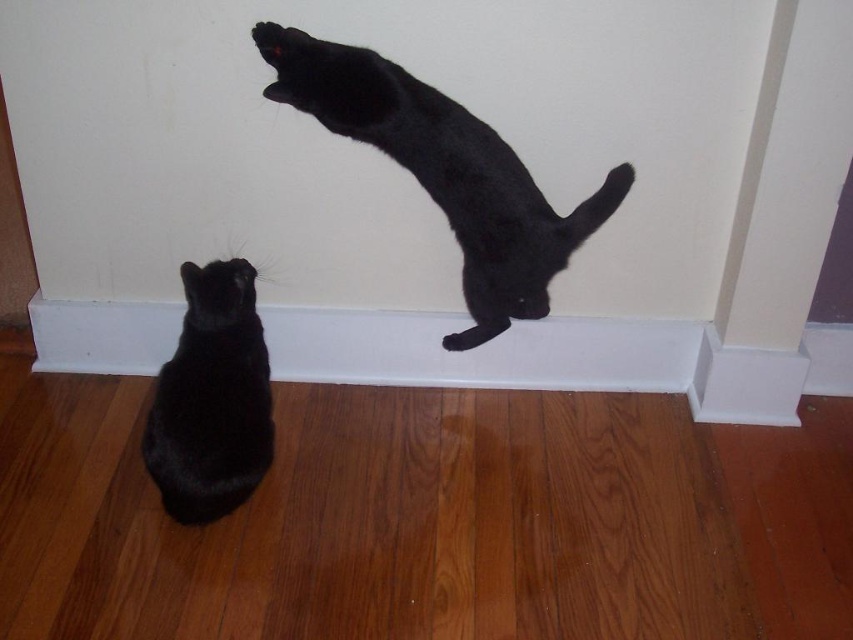
Consider the image. You are standing in the room and see two points marked in the image. Which point is closer to you, point (531, 280) or point (196, 397)?

Point (531, 280) is further to the viewer than point (196, 397), so point (196, 397) is closer to you.